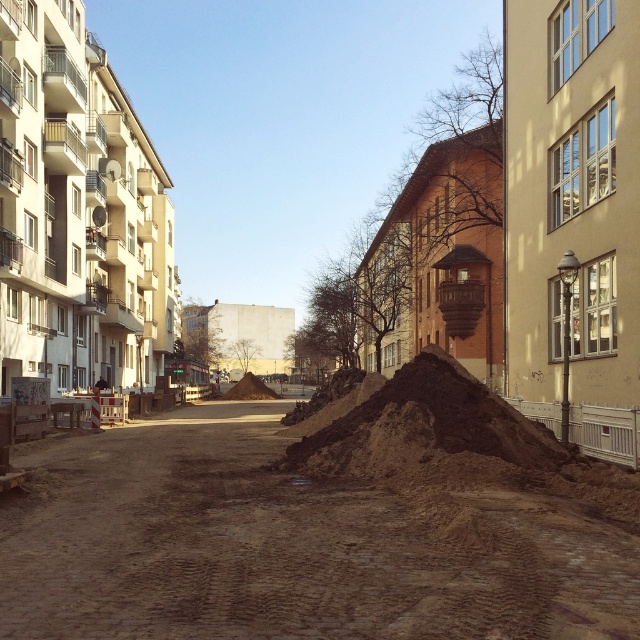
Question: Which of the following is the closest to the observer?

Choices:
 (A) (225, 538)
 (B) (508, 410)

Answer: (A)

Question: Does brown dirt track at center appear under brown earth mound at center?

Choices:
 (A) yes
 (B) no

Answer: (B)

Question: Where is brown dirt track at center located in relation to brown earth mound at center in the image?

Choices:
 (A) below
 (B) above

Answer: (B)

Question: Is brown dirt track at center to the right of brown earth mound at center from the viewer's perspective?

Choices:
 (A) yes
 (B) no

Answer: (B)

Question: Which of the following is the closest to the observer?

Choices:
 (A) brown dirt track at center
 (B) brown earth mound at center

Answer: (A)

Question: Among these points, which one is farthest from the camera?

Choices:
 (A) (241, 416)
 (B) (403, 385)

Answer: (A)